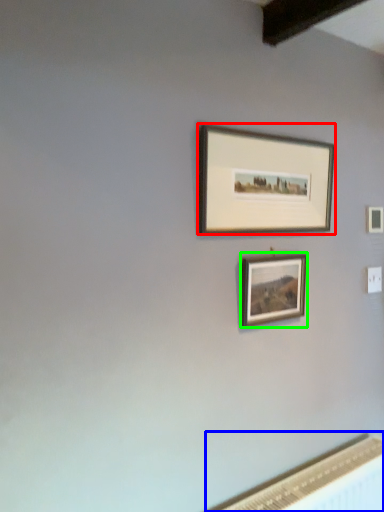
Question: Estimate the real-world distances between objects in this image. Which object is closer to picture frame (highlighted by a red box), radiator (highlighted by a blue box) or picture frame (highlighted by a green box)?

Choices:
 (A) radiator
 (B) picture frame

Answer: (B)